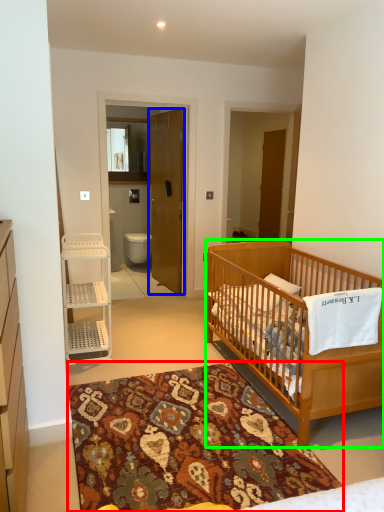
Question: Which is farther away from mat (highlighted by a red box)? door (highlighted by a blue box) or infant bed (highlighted by a green box)?

Choices:
 (A) door
 (B) infant bed

Answer: (A)